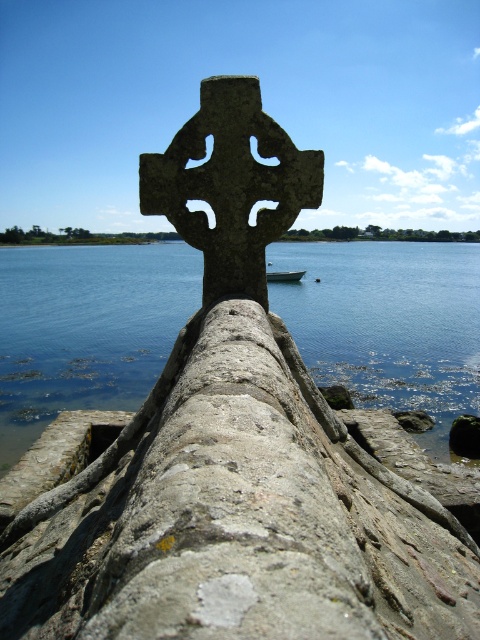
Question: Is blue water at center positioned behind white matte boat at center?

Choices:
 (A) no
 (B) yes

Answer: (B)

Question: Is blue water at center to the right of white matte boat at center from the viewer's perspective?

Choices:
 (A) no
 (B) yes

Answer: (A)

Question: Is blue water at center wider than white matte boat at center?

Choices:
 (A) yes
 (B) no

Answer: (A)

Question: Which object is closer to the camera taking this photo?

Choices:
 (A) white matte boat at center
 (B) blue water at center

Answer: (A)